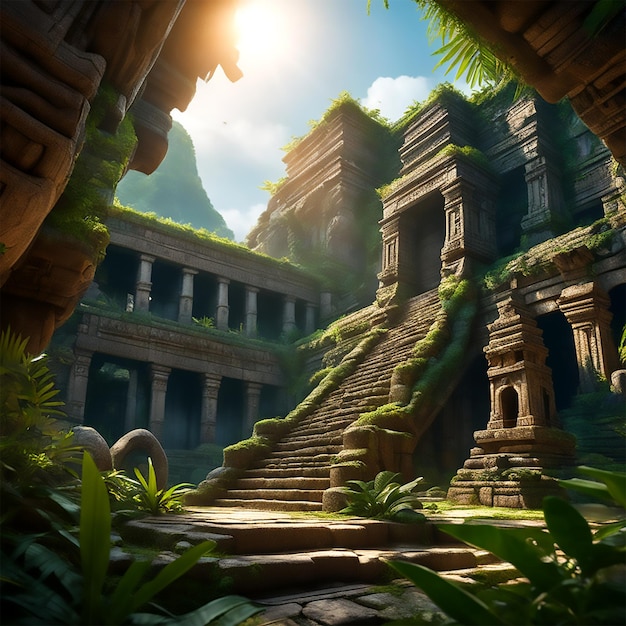
This screenshot has height=626, width=626. I want to click on columns, so coord(144,274), coord(188,285), coord(212,409), coord(161,396).